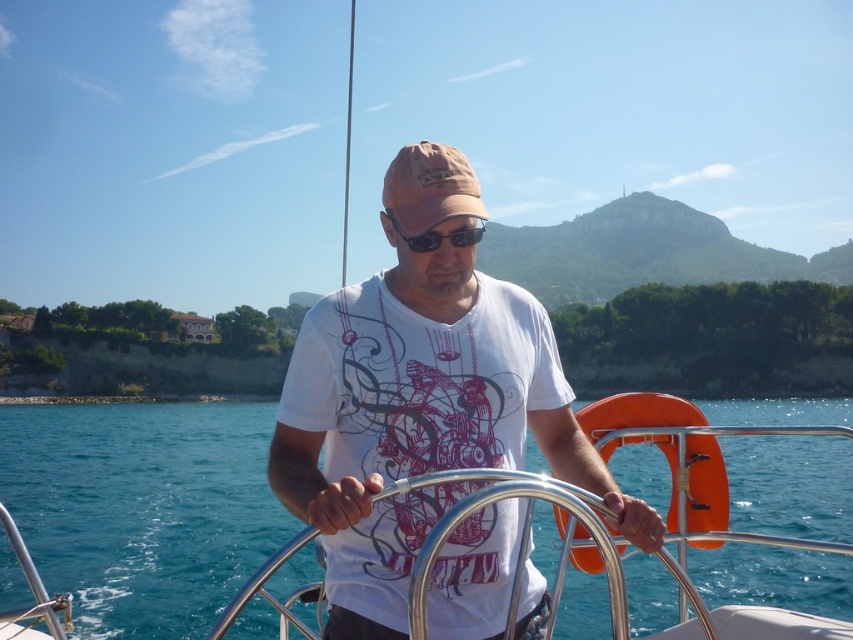
Who is positioned more to the left, white matte t-shirt at center or tan fabric baseball cap at center?

white matte t-shirt at center is more to the left.

Find the location of `white matte t-shirt at center`. white matte t-shirt at center is located at coordinates (421, 420).

Find the location of a particular element. The height and width of the screenshot is (640, 853). white matte t-shirt at center is located at coordinates pyautogui.click(x=421, y=420).

Does clear blue water at center appear over tan fabric baseball cap at center?

Incorrect, clear blue water at center is not positioned above tan fabric baseball cap at center.

In the scene shown: Can you confirm if clear blue water at center is bigger than tan fabric baseball cap at center?

Yes, clear blue water at center is bigger than tan fabric baseball cap at center.

The height and width of the screenshot is (640, 853). What do you see at coordinates (142, 508) in the screenshot? I see `clear blue water at center` at bounding box center [142, 508].

At what (x,y) coordinates should I click in order to perform the action: click on clear blue water at center. Please return your answer as a coordinate pair (x, y). This screenshot has width=853, height=640. Looking at the image, I should click on (142, 508).

Does clear blue water at center have a lesser height compared to white matte t-shirt at center?

No.

Is point (215, 608) positioned before point (421, 436)?

No, it is not.

Does point (28, 451) lie behind point (386, 598)?

Yes, point (28, 451) is behind point (386, 598).

Locate an element on the screen. clear blue water at center is located at coordinates (142, 508).